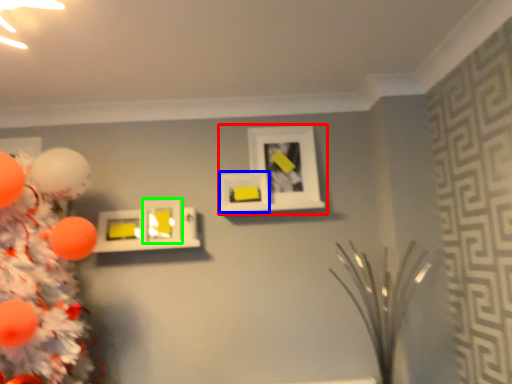
Question: Estimate the real-world distances between objects in this image. Which object is closer to picture frame (highlighted by a red box), picture frame (highlighted by a blue box) or picture frame (highlighted by a green box)?

Choices:
 (A) picture frame
 (B) picture frame

Answer: (A)